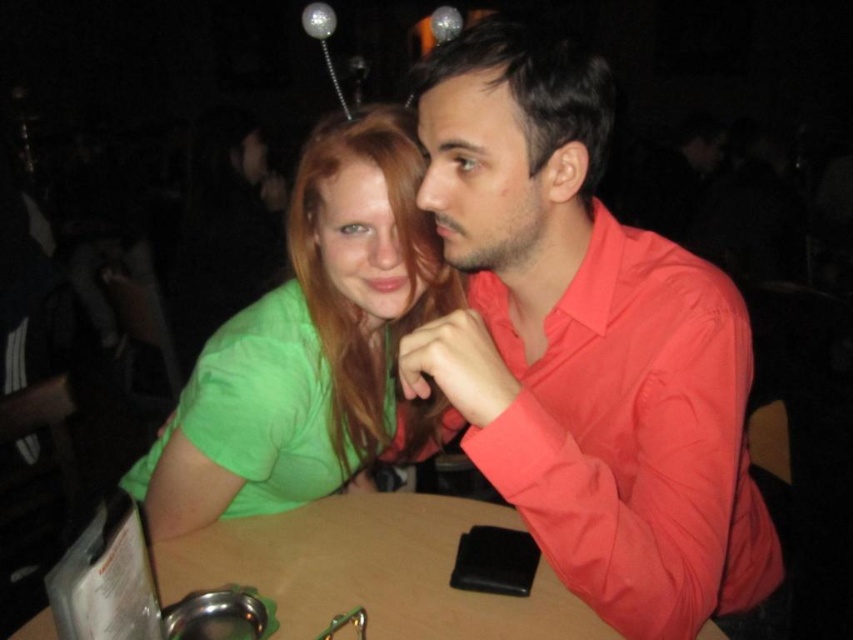
Is matte red shirt at center below brown wooden table at center?

No, matte red shirt at center is not below brown wooden table at center.

Can you confirm if matte red shirt at center is shorter than brown wooden table at center?

No.

Who is more forward, (537, 228) or (392, 529)?

Point (537, 228)

At what (x,y) coordinates should I click in order to perform the action: click on matte red shirt at center. Please return your answer as a coordinate pair (x, y). Image resolution: width=853 pixels, height=640 pixels. Looking at the image, I should click on (585, 344).

Looking at this image, who is lower down, matte red shirt at center or green matte shirt at center?

Positioned lower is matte red shirt at center.

Is matte red shirt at center further to camera compared to green matte shirt at center?

No, it is not.

Between point (744, 314) and point (350, 168), which one is positioned in front?

Point (744, 314)

This screenshot has height=640, width=853. I want to click on matte red shirt at center, so (x=585, y=344).

Who is positioned more to the right, green matte shirt at center or brown wooden table at center?

brown wooden table at center is more to the right.

Between green matte shirt at center and brown wooden table at center, which one appears on the left side from the viewer's perspective?

From the viewer's perspective, green matte shirt at center appears more on the left side.

Which is in front, point (347, 154) or point (437, 499)?

Point (347, 154)

Where is `green matte shirt at center`? The width and height of the screenshot is (853, 640). green matte shirt at center is located at coordinates (308, 340).